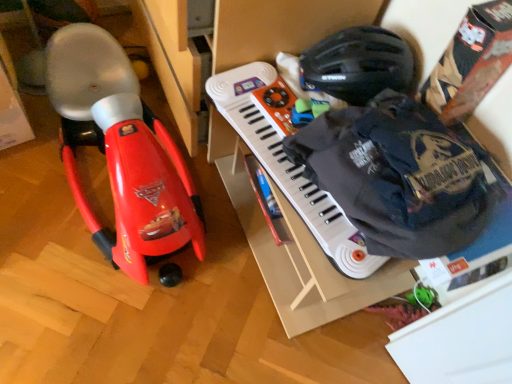
Image resolution: width=512 pixels, height=384 pixels. I want to click on matte red toy car at left, so click(x=121, y=151).

The image size is (512, 384). What do you see at coordinates (288, 161) in the screenshot?
I see `white plastic musical keyboard at center` at bounding box center [288, 161].

The image size is (512, 384). I want to click on matte red toy car at left, so click(x=121, y=151).

Is matte red toy car at left to the right of white plastic musical keyboard at center from the viewer's perspective?

No.

Is matte red toy car at left not close to white plastic musical keyboard at center?

matte red toy car at left is actually quite close to white plastic musical keyboard at center.

What's the angular difference between matte red toy car at left and white plastic musical keyboard at center's facing directions?

The angle between the facing direction of matte red toy car at left and the facing direction of white plastic musical keyboard at center is 86.6 degrees.

Does point (89, 137) appear closer or farther from the camera than point (233, 98)?

Point (89, 137) is farther from the camera than point (233, 98).

Looking at this image, is black matte helmet at upper right at the right side of matte red toy car at left?

Indeed, black matte helmet at upper right is positioned on the right side of matte red toy car at left.

Considering the relative sizes of black matte helmet at upper right and matte red toy car at left in the image provided, is black matte helmet at upper right bigger than matte red toy car at left?

Incorrect, black matte helmet at upper right is not larger than matte red toy car at left.

Is black matte helmet at upper right positioned far away from matte red toy car at left?

No.

Is black matte helmet at upper right not inside matte red toy car at left?

Yes, black matte helmet at upper right is not within matte red toy car at left.

Does matte red toy car at left have a greater height compared to black matte helmet at upper right?

Yes.

Is matte red toy car at left directly adjacent to black matte helmet at upper right?

No, matte red toy car at left is not with black matte helmet at upper right.

The height and width of the screenshot is (384, 512). I want to click on toy in front of the black matte helmet at upper right, so click(121, 151).

Considering the relative positions of white plastic musical keyboard at center and black matte helmet at upper right in the image provided, is white plastic musical keyboard at center to the right of black matte helmet at upper right from the viewer's perspective?

In fact, white plastic musical keyboard at center is to the left of black matte helmet at upper right.

Is point (251, 80) farther from viewer compared to point (402, 51)?

Yes.

Could you tell me if white plastic musical keyboard at center is turned towards black matte helmet at upper right?

No, white plastic musical keyboard at center is not turned towards black matte helmet at upper right.

Is black matte helmet at upper right surrounded by white plastic musical keyboard at center?

No.

From a real-world perspective, between white plastic musical keyboard at center and matte red toy car at left, who is vertically higher?

white plastic musical keyboard at center, from a real-world perspective.

Which is farther, (281, 116) or (109, 112)?

Point (281, 116)

Based on the photo, is white plastic musical keyboard at center facing away from matte red toy car at left?

white plastic musical keyboard at center does not have its back to matte red toy car at left.

Would you say white plastic musical keyboard at center is to the left or to the right of matte red toy car at left in the picture?

white plastic musical keyboard at center is to the right of matte red toy car at left.

From a real-world perspective, is black matte helmet at upper right above or below white plastic musical keyboard at center?

In terms of real-world spatial position, black matte helmet at upper right is above white plastic musical keyboard at center.

Between black matte helmet at upper right and white plastic musical keyboard at center, which one appears on the right side from the viewer's perspective?

Positioned to the right is black matte helmet at upper right.

What are the coordinates of `musical keyboard located underneath the black matte helmet at upper right (from a real-world perspective)` in the screenshot? It's located at (288, 161).

At what (x,y) coordinates should I click in order to perform the action: click on toy in front of the white plastic musical keyboard at center. Please return your answer as a coordinate pair (x, y). Image resolution: width=512 pixels, height=384 pixels. Looking at the image, I should click on (121, 151).

You are a GUI agent. You are given a task and a screenshot of the screen. Output one action in this format:
    pyautogui.click(x=<x>, y=<y>)
    Task: Click on the helmet above the matte red toy car at left (from a real-world perspective)
    The image size is (512, 384).
    Given the screenshot: What is the action you would take?
    pyautogui.click(x=359, y=64)

Estimate the real-world distances between objects in this image. Which object is further from black matte helmet at upper right, matte red toy car at left or white plastic musical keyboard at center?

matte red toy car at left is further to black matte helmet at upper right.

Looking at the image, which one is located further to black matte helmet at upper right, white plastic musical keyboard at center or matte red toy car at left?

matte red toy car at left.

Which object lies further to the anchor point white plastic musical keyboard at center, matte red toy car at left or black matte helmet at upper right?

Among the two, matte red toy car at left is located further to white plastic musical keyboard at center.

From the image, which object appears to be nearer to matte red toy car at left, black matte helmet at upper right or white plastic musical keyboard at center?

white plastic musical keyboard at center lies closer to matte red toy car at left than the other object.

Considering their positions, is white plastic musical keyboard at center positioned further to matte red toy car at left than black matte helmet at upper right?

black matte helmet at upper right lies further to matte red toy car at left than the other object.

Estimate the real-world distances between objects in this image. Which object is further from white plastic musical keyboard at center, black matte helmet at upper right or matte red toy car at left?

Based on the image, matte red toy car at left appears to be further to white plastic musical keyboard at center.

Where is `musical keyboard between matte red toy car at left and black matte helmet at upper right in the horizontal direction`? This screenshot has height=384, width=512. musical keyboard between matte red toy car at left and black matte helmet at upper right in the horizontal direction is located at coordinates (288, 161).